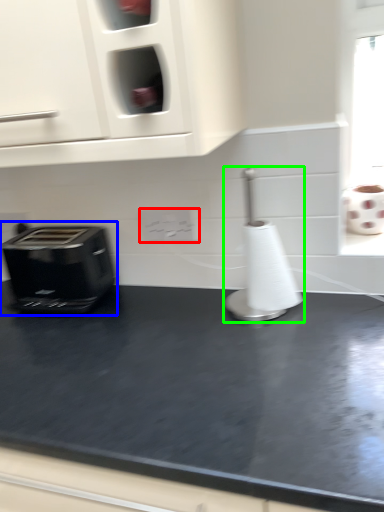
Question: Considering the real-world distances, which object is farthest from electric outlet (highlighted by a red box)? toaster (highlighted by a blue box) or appliance (highlighted by a green box)?

Choices:
 (A) toaster
 (B) appliance

Answer: (A)